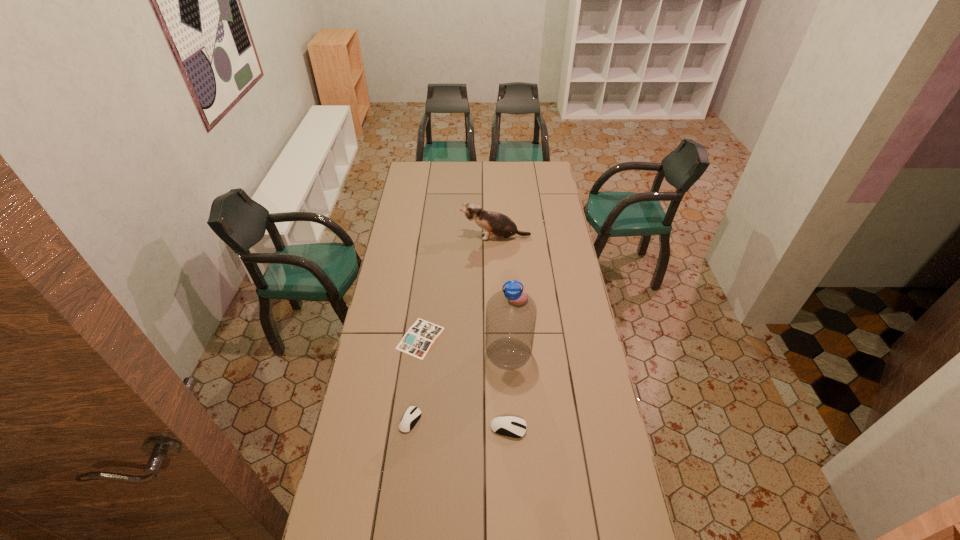
Identify the location of free space at the near left corner of the desktop. The height and width of the screenshot is (540, 960). (379, 523).

What are the coordinates of `vacant region at the far right corner of the desktop` in the screenshot? It's located at (533, 162).

Identify the location of free space between the taller mouse and the left mouse. The height and width of the screenshot is (540, 960). (460, 424).

Locate an element on the screen. This screenshot has height=540, width=960. free spot between the left mouse and the book is located at coordinates (416, 379).

Identify the location of unoccupied position between the left mouse and the tallest object. The image size is (960, 540). (460, 387).

Find the location of a particular element. This screenshot has width=960, height=540. vacant point located between the fifth nearest object and the shortest object is located at coordinates (468, 319).

Identify the location of empty location between the shorter mouse and the book. This screenshot has width=960, height=540. (416, 379).

Locate an element on the screen. empty space that is in between the tallest object and the taller mouse is located at coordinates (509, 392).

At what (x,y) coordinates should I click in order to perform the action: click on object that is the closest to the left mouse. Please return your answer as a coordinate pair (x, y). This screenshot has width=960, height=540. Looking at the image, I should click on (420, 337).

You are a GUI agent. You are given a task and a screenshot of the screen. Output one action in this format:
    pyautogui.click(x=<x>, y=<y>)
    Task: Click on the object that is the second closest one to the right mouse
    The height and width of the screenshot is (540, 960).
    Given the screenshot: What is the action you would take?
    pyautogui.click(x=411, y=416)